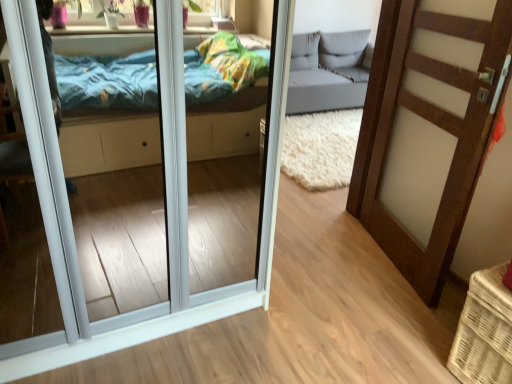
Question: From a real-world perspective, does white glossy door at center, positioned as the 1th door in left-to-right order, stand above brown wood door at right, which is the 2th door from left to right?

Choices:
 (A) yes
 (B) no

Answer: (B)

Question: Is white glossy door at center, positioned as the 1th door in left-to-right order, looking in the opposite direction of brown wood door at right, placed as the 1th door when sorted from right to left?

Choices:
 (A) no
 (B) yes

Answer: (A)

Question: From the image's perspective, is white glossy door at center, acting as the 2th door starting from the right, located beneath brown wood door at right, which is the 2th door from left to right?

Choices:
 (A) yes
 (B) no

Answer: (A)

Question: Does white glossy door at center, acting as the 2th door starting from the right, have a greater height compared to brown wood door at right, placed as the 1th door when sorted from right to left?

Choices:
 (A) no
 (B) yes

Answer: (A)

Question: Is white glossy door at center, acting as the 2th door starting from the right, positioned behind brown wood door at right, which is the 2th door from left to right?

Choices:
 (A) no
 (B) yes

Answer: (A)

Question: Considering the relative positions of white wicker basket at lower right and white glossy door at center, acting as the 2th door starting from the right, in the image provided, is white wicker basket at lower right to the left or to the right of white glossy door at center, acting as the 2th door starting from the right,?

Choices:
 (A) left
 (B) right

Answer: (B)

Question: Choose the correct answer: Is white wicker basket at lower right inside white glossy door at center, acting as the 2th door starting from the right, or outside it?

Choices:
 (A) outside
 (B) inside

Answer: (A)

Question: In terms of height, does white wicker basket at lower right look taller or shorter compared to white glossy door at center, acting as the 2th door starting from the right?

Choices:
 (A) short
 (B) tall

Answer: (A)

Question: From a real-world perspective, is white wicker basket at lower right above or below white glossy door at center, positioned as the 1th door in left-to-right order?

Choices:
 (A) above
 (B) below

Answer: (B)

Question: Would you say white glossy door at center, positioned as the 1th door in left-to-right order, is to the left or to the right of white wicker basket at lower right in the picture?

Choices:
 (A) left
 (B) right

Answer: (A)

Question: Looking at the image, does white glossy door at center, positioned as the 1th door in left-to-right order, seem bigger or smaller compared to white wicker basket at lower right?

Choices:
 (A) big
 (B) small

Answer: (A)

Question: From a real-world perspective, is white glossy door at center, positioned as the 1th door in left-to-right order, physically located above or below white wicker basket at lower right?

Choices:
 (A) below
 (B) above

Answer: (B)

Question: Is white glossy door at center, acting as the 2th door starting from the right, wider or thinner than white wicker basket at lower right?

Choices:
 (A) wide
 (B) thin

Answer: (A)

Question: From the image's perspective, is brown wood door at right, which is the 2th door from left to right, above or below white wicker basket at lower right?

Choices:
 (A) above
 (B) below

Answer: (A)

Question: From a real-world perspective, is brown wood door at right, which is the 2th door from left to right, above or below white wicker basket at lower right?

Choices:
 (A) below
 (B) above

Answer: (B)